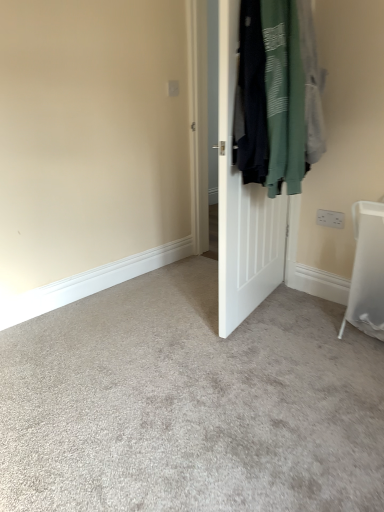
Question: Is dark green cotton sweatshirt at right at the back of white plastic electric outlet at upper right?

Choices:
 (A) no
 (B) yes

Answer: (A)

Question: From a real-world perspective, is white plastic electric outlet at upper right located beneath dark green cotton sweatshirt at right?

Choices:
 (A) no
 (B) yes

Answer: (B)

Question: Is white plastic electric outlet at upper right facing towards dark green cotton sweatshirt at right?

Choices:
 (A) no
 (B) yes

Answer: (A)

Question: From the image's perspective, does white plastic electric outlet at upper right appear higher than dark green cotton sweatshirt at right?

Choices:
 (A) yes
 (B) no

Answer: (B)

Question: Does white plastic electric outlet at upper right lie behind dark green cotton sweatshirt at right?

Choices:
 (A) yes
 (B) no

Answer: (A)

Question: Considering the relative positions of dark green cotton sweatshirt at right and white plastic electric outlet at upper right in the image provided, is dark green cotton sweatshirt at right to the left or to the right of white plastic electric outlet at upper right?

Choices:
 (A) left
 (B) right

Answer: (A)

Question: Does point (311, 81) appear closer or farther from the camera than point (334, 225)?

Choices:
 (A) farther
 (B) closer

Answer: (B)

Question: Is dark green cotton sweatshirt at right bigger or smaller than white plastic electric outlet at upper right?

Choices:
 (A) big
 (B) small

Answer: (A)

Question: From the image's perspective, is dark green cotton sweatshirt at right positioned above or below white plastic electric outlet at upper right?

Choices:
 (A) below
 (B) above

Answer: (B)

Question: From the image's perspective, is white matte door at center positioned above or below dark green cotton sweatshirt at right?

Choices:
 (A) above
 (B) below

Answer: (B)

Question: Considering the positions of white matte door at center and dark green cotton sweatshirt at right in the image, is white matte door at center bigger or smaller than dark green cotton sweatshirt at right?

Choices:
 (A) big
 (B) small

Answer: (B)

Question: Do you think white matte door at center is within dark green cotton sweatshirt at right, or outside of it?

Choices:
 (A) inside
 (B) outside

Answer: (B)

Question: From a real-world perspective, is white matte door at center above or below dark green cotton sweatshirt at right?

Choices:
 (A) above
 (B) below

Answer: (B)

Question: Visually, is white plastic electric outlet at upper right positioned to the left or to the right of dark green cotton sweatshirt at right?

Choices:
 (A) right
 (B) left

Answer: (A)

Question: From the image's perspective, relative to dark green cotton sweatshirt at right, is white plastic electric outlet at upper right above or below?

Choices:
 (A) above
 (B) below

Answer: (B)